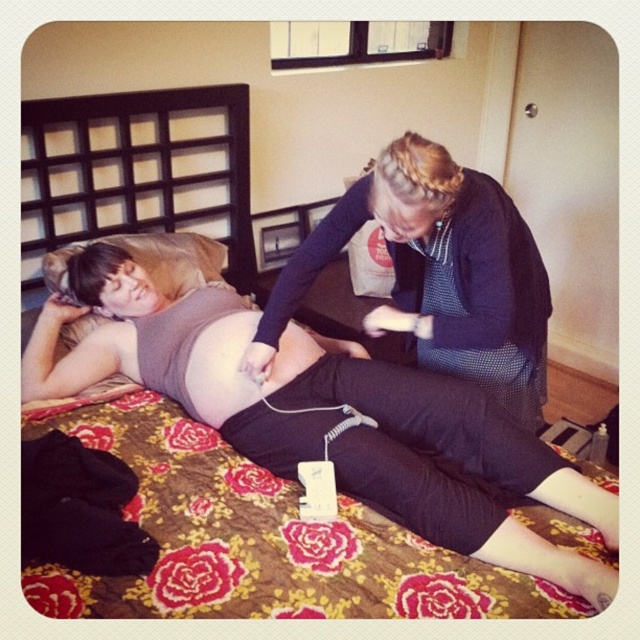
Is dark blue textured sweater at upper center shorter than brown fabric pillow at upper left?

No, dark blue textured sweater at upper center is not shorter than brown fabric pillow at upper left.

Does point (435, 243) come in front of point (150, 243)?

Yes, point (435, 243) is closer to viewer.

Identify the location of dark blue textured sweater at upper center. The image size is (640, 640). (436, 273).

Which is more to the left, matte skin at center or brown fabric pillow at upper left?

brown fabric pillow at upper left

Who is more forward, (x=282, y=355) or (x=45, y=259)?

Positioned in front is point (x=282, y=355).

Which is in front, point (237, 401) or point (196, 253)?

Point (237, 401) is in front.

You are a GUI agent. You are given a task and a screenshot of the screen. Output one action in this format:
    pyautogui.click(x=<x>, y=<y>)
    Task: Click on the matte skin at center
    This screenshot has height=640, width=640.
    Given the screenshot: What is the action you would take?
    pyautogui.click(x=241, y=364)

Who is more distant from viewer, (424, 358) or (250, 396)?

Point (424, 358)

Which of these two, dark blue textured sweater at upper center or matte skin at center, stands taller?

Standing taller between the two is dark blue textured sweater at upper center.

Is point (428, 225) in front of point (266, 380)?

Yes.

Find the location of a particular element. dark blue textured sweater at upper center is located at coordinates (436, 273).